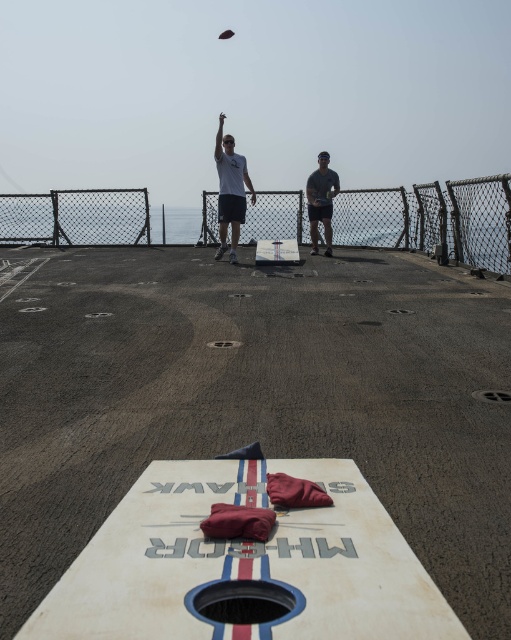
You are on the deck of a ship and see the dark gray fabric at center and the dark brown wooden frisbee at upper center. Which object is positioned higher from the deck?

The dark brown wooden frisbee at upper center is positioned higher from the deck than the dark gray fabric at center because it is located above it.

You are standing on the deck of a ship and see the dark gray fabric at center and the dark brown wooden frisbee at upper center. Which object is closer to the water below?

The dark gray fabric at center is closer to the water below since it is shorter than the dark brown wooden frisbee at upper center.